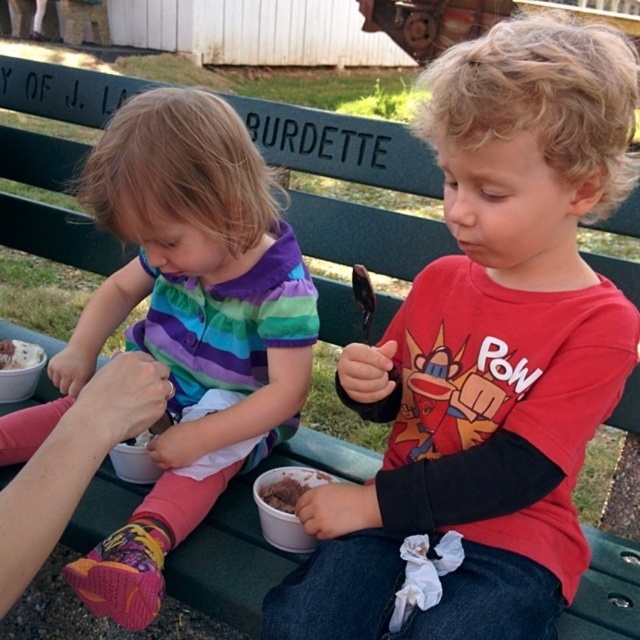
Is matte red shirt at center bigger than multicolored striped shirt at center?

Actually, matte red shirt at center might be smaller than multicolored striped shirt at center.

Image resolution: width=640 pixels, height=640 pixels. Find the location of `matte red shirt at center`. matte red shirt at center is located at coordinates (486, 353).

The width and height of the screenshot is (640, 640). Identify the location of matte red shirt at center. (486, 353).

Does chocolate ice cream at lower center lie in front of white matte ice cream at lower left?

Yes, chocolate ice cream at lower center is closer to the viewer.

Is point (304, 474) behind point (20, 342)?

No, it is in front of (20, 342).

Locate an element on the screen. The height and width of the screenshot is (640, 640). chocolate ice cream at lower center is located at coordinates (289, 488).

Can you confirm if multicolored striped shirt at center is bigger than chocolate ice cream at lower center?

Yes, multicolored striped shirt at center is bigger than chocolate ice cream at lower center.

Is multicolored striped shirt at center wider than chocolate ice cream at lower center?

Yes, multicolored striped shirt at center is wider than chocolate ice cream at lower center.

This screenshot has width=640, height=640. What are the coordinates of `multicolored striped shirt at center` in the screenshot? It's located at pyautogui.click(x=184, y=324).

The image size is (640, 640). In order to click on multicolored striped shirt at center in this screenshot , I will do `click(184, 324)`.